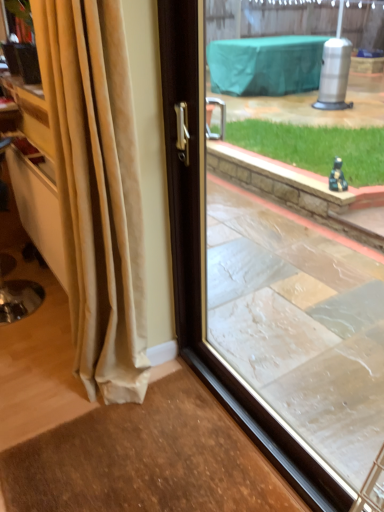
Question: Considering the relative positions of transparent glass window at center and beige velvet curtain at left in the image provided, is transparent glass window at center to the left or to the right of beige velvet curtain at left?

Choices:
 (A) left
 (B) right

Answer: (B)

Question: From the image's perspective, relative to beige velvet curtain at left, is transparent glass window at center above or below?

Choices:
 (A) below
 (B) above

Answer: (A)

Question: Considering their positions, is transparent glass window at center located in front of or behind beige velvet curtain at left?

Choices:
 (A) behind
 (B) front

Answer: (B)

Question: Is beige velvet curtain at left taller or shorter than transparent glass window at center?

Choices:
 (A) tall
 (B) short

Answer: (A)

Question: Looking at their shapes, would you say beige velvet curtain at left is wider or thinner than transparent glass window at center?

Choices:
 (A) thin
 (B) wide

Answer: (B)

Question: Is point (122, 258) closer or farther from the camera than point (334, 468)?

Choices:
 (A) closer
 (B) farther

Answer: (B)

Question: From the image's perspective, is beige velvet curtain at left above or below transparent glass window at center?

Choices:
 (A) below
 (B) above

Answer: (B)